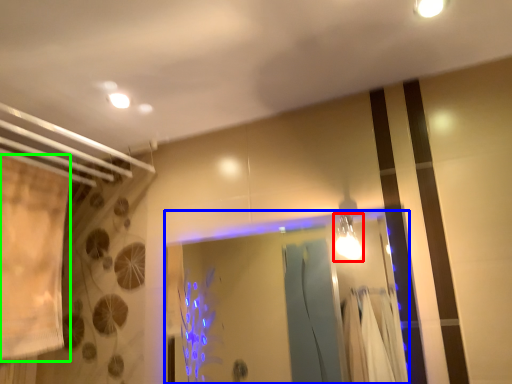
Question: Considering the real-world distances, which object is closest to light fixture (highlighted by a red box)? glass door (highlighted by a blue box) or shower curtain (highlighted by a green box).

Choices:
 (A) glass door
 (B) shower curtain

Answer: (A)